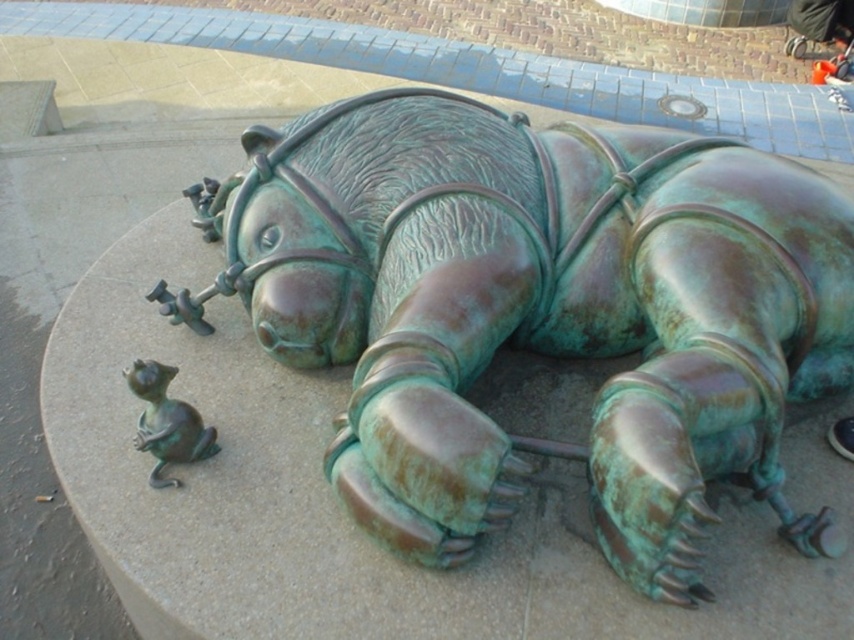
Question: Which object is closer to the camera taking this photo?

Choices:
 (A) green patina horse at center
 (B) green patina mouse at lower left

Answer: (A)

Question: Is green patina horse at center thinner than green patina mouse at lower left?

Choices:
 (A) no
 (B) yes

Answer: (A)

Question: Is green patina horse at center thinner than green patina mouse at lower left?

Choices:
 (A) no
 (B) yes

Answer: (A)

Question: Is green patina horse at center smaller than green patina mouse at lower left?

Choices:
 (A) no
 (B) yes

Answer: (A)

Question: Which object appears farthest from the camera in this image?

Choices:
 (A) green patina horse at center
 (B) green patina mouse at lower left

Answer: (B)